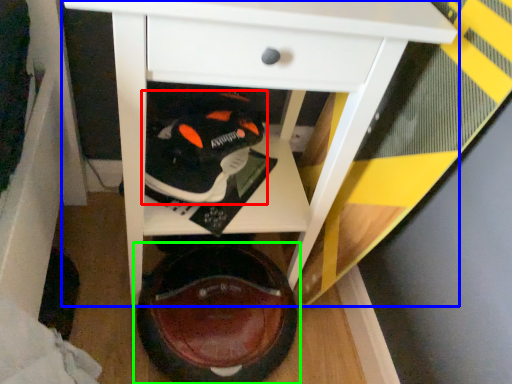
Question: Which is nearer to the footwear (highlighted by a red box)? table (highlighted by a blue box) or footwear (highlighted by a green box).

Choices:
 (A) table
 (B) footwear

Answer: (A)